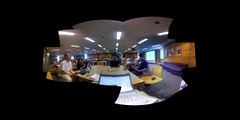
The image size is (240, 120). In order to click on sticker in this screenshot , I will do `click(144, 101)`.